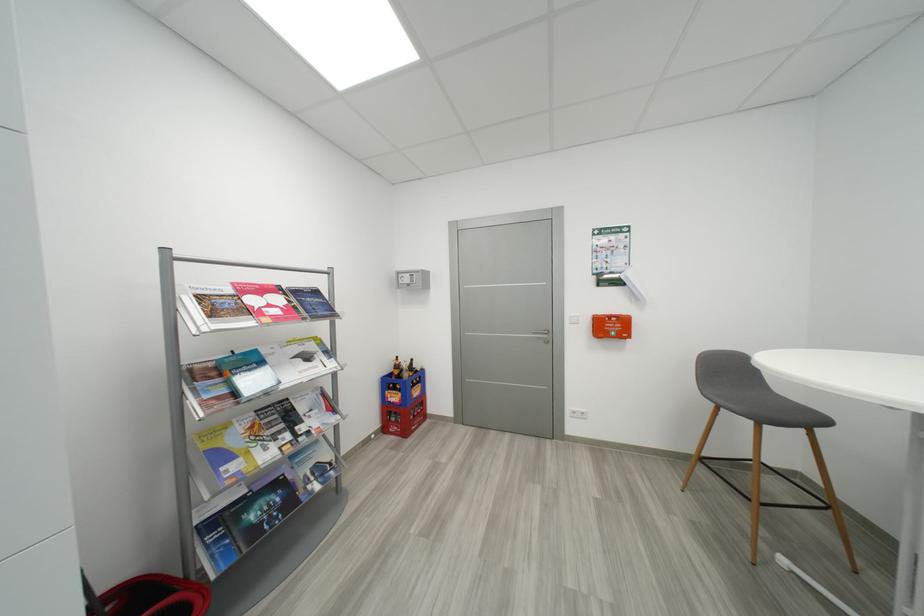
What do you see at coordinates (412, 280) in the screenshot?
I see `a silver safe dial` at bounding box center [412, 280].